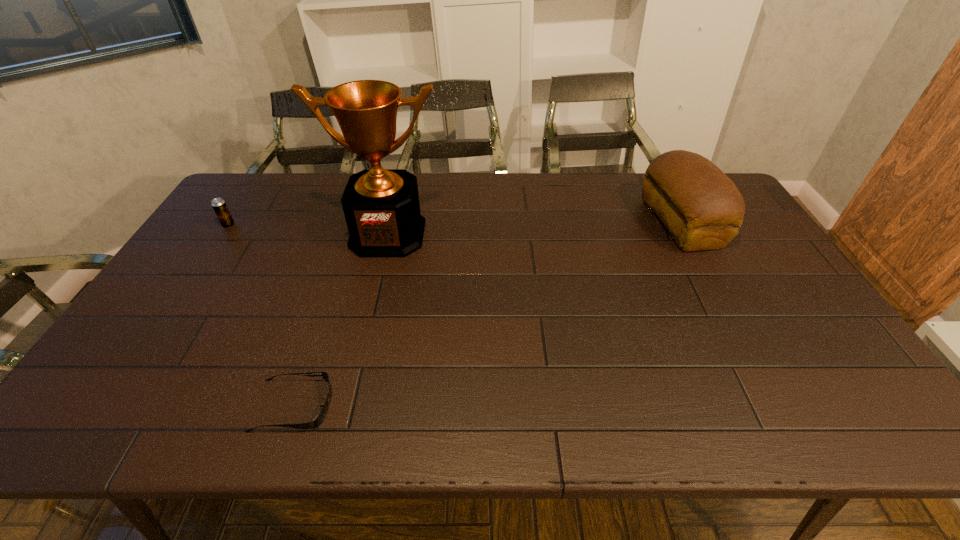
This screenshot has width=960, height=540. In order to click on vacant area between the trophy cup and the beer can in this screenshot , I will do `click(308, 230)`.

Where is `vacant space in between the shortest object and the rightmost object`? The image size is (960, 540). vacant space in between the shortest object and the rightmost object is located at coordinates (487, 314).

This screenshot has height=540, width=960. Find the location of `free point between the leftmost object and the tallest object`. free point between the leftmost object and the tallest object is located at coordinates (308, 230).

At what (x,y) coordinates should I click in order to perform the action: click on free space between the shortest object and the trophy cup. Please return your answer as a coordinate pair (x, y). The height and width of the screenshot is (540, 960). Looking at the image, I should click on (341, 320).

Where is `vacant area between the sunglasses and the trophy cup`? Image resolution: width=960 pixels, height=540 pixels. vacant area between the sunglasses and the trophy cup is located at coordinates (341, 320).

Locate an element on the screen. This screenshot has height=540, width=960. blank region between the second tallest object and the nearest object is located at coordinates (487, 314).

The image size is (960, 540). I want to click on unoccupied area between the beer can and the nearest object, so tap(261, 315).

Identify the location of vacant area that lies between the tallest object and the leftmost object. The image size is (960, 540). (308, 230).

The height and width of the screenshot is (540, 960). Identify the location of empty space that is in between the shortest object and the third tallest object. (261, 315).

The image size is (960, 540). In order to click on object that is the second closest to the trophy cup in this screenshot , I will do (320, 417).